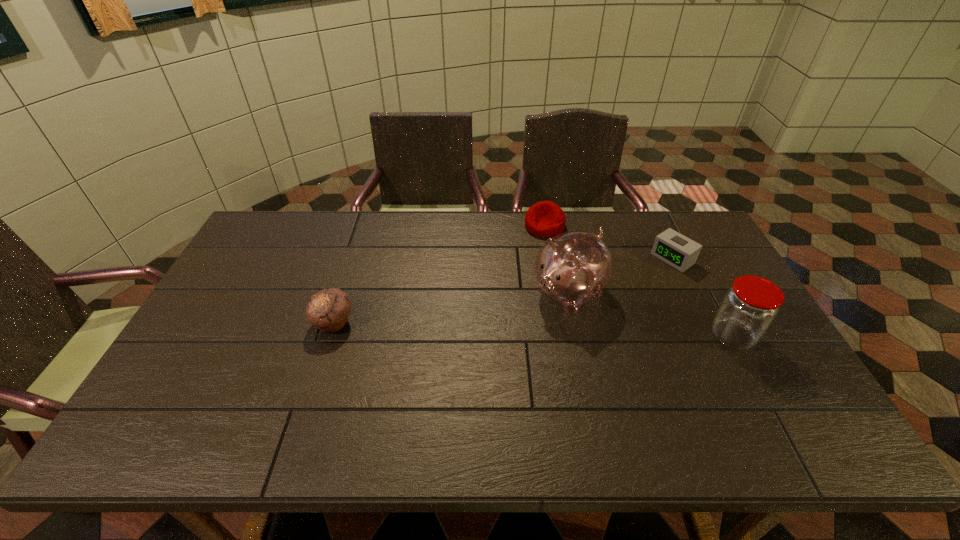
Where is `free location that satisfies the following two spatial constraints: 1. on the front side of the alarm clock; 2. on the right side of the farthest object`? This screenshot has width=960, height=540. free location that satisfies the following two spatial constraints: 1. on the front side of the alarm clock; 2. on the right side of the farthest object is located at coordinates (550, 259).